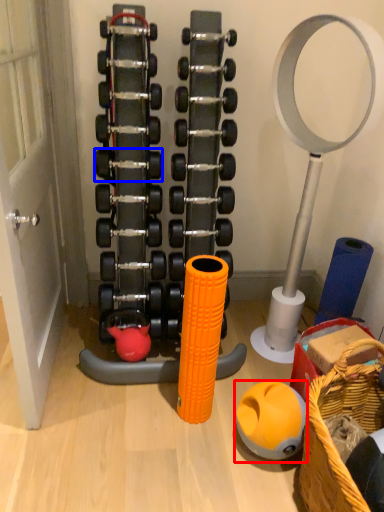
Question: Which of the following is the farthest to the observer, ball (highlighted by a red box) or dumbbell (highlighted by a blue box)?

Choices:
 (A) ball
 (B) dumbbell

Answer: (B)